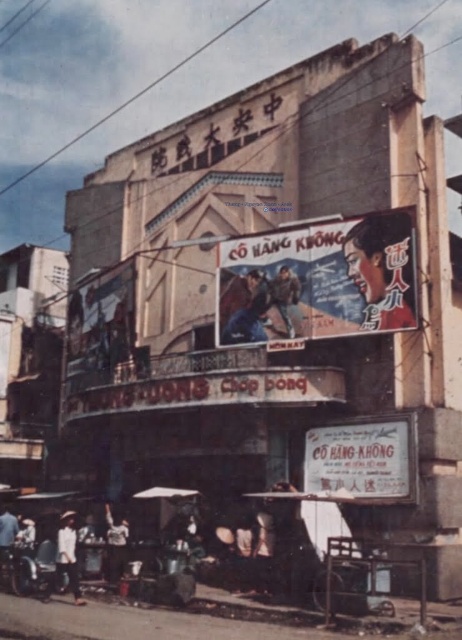
Question: Is smooth plastic face at center wider than brown leather jacket at center?

Choices:
 (A) yes
 (B) no

Answer: (B)

Question: Which point is closer to the camera?

Choices:
 (A) dark blue fabric at center
 (B) light brown wooden cart at lower left
 (C) smooth plastic face at center

Answer: (C)

Question: Is matte plastic poster at center thinner than light brown wooden cart at lower left?

Choices:
 (A) yes
 (B) no

Answer: (B)

Question: Is white paper billboard at center positioned in front of light brown wooden cart at lower left?

Choices:
 (A) no
 (B) yes

Answer: (B)

Question: Which of these objects is positioned closest to the smooth plastic face at center?

Choices:
 (A) matte plastic poster at center
 (B) white paper billboard at center

Answer: (A)

Question: Among these points, which one is nearest to the camera?

Choices:
 (A) (267, 285)
 (B) (6, 534)

Answer: (B)